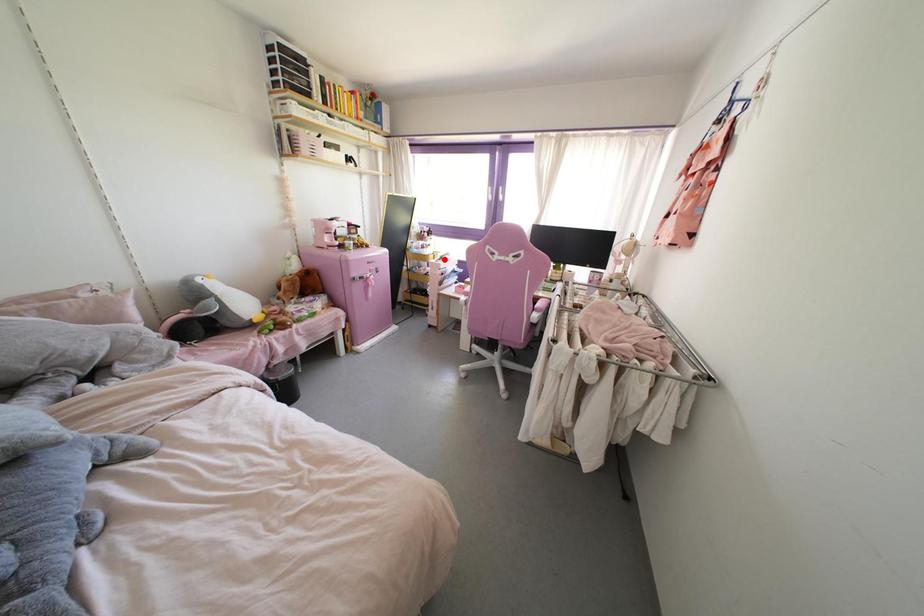
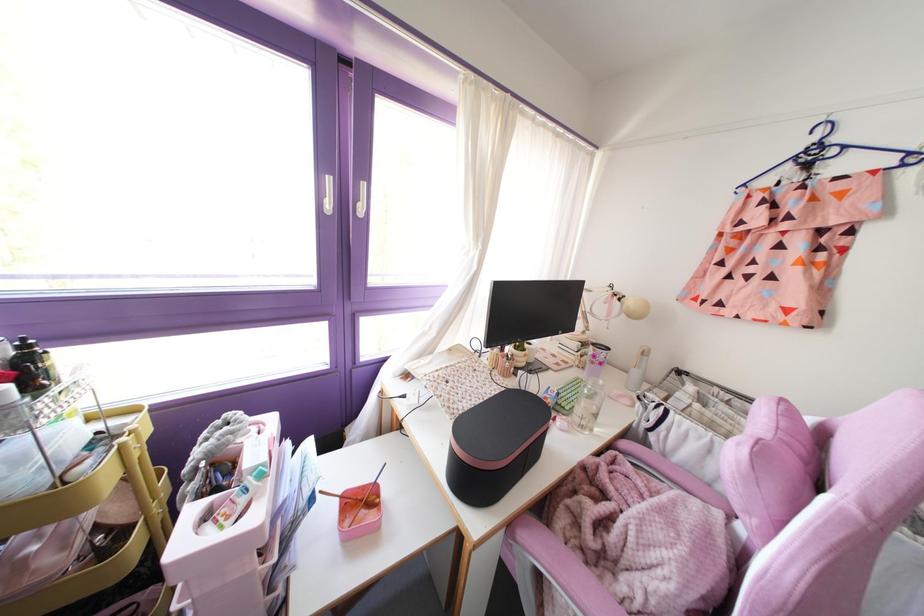
Question: I am providing you with two images of the same scene from different viewpoints. In image1, a red point is highlighted. Considering the same 3D point in image2, which of the following is correct?

Choices:
 (A) It is closer
 (B) It is farther

Answer: (B)